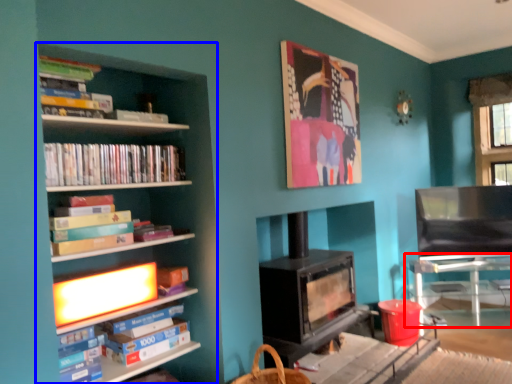
Question: Among these objects, which one is nearest to the camera, table (highlighted by a red box) or shelf (highlighted by a blue box)?

Choices:
 (A) table
 (B) shelf

Answer: (B)